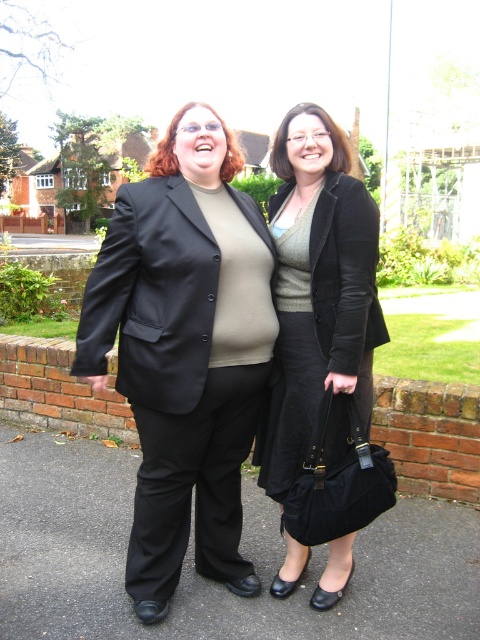
Question: Which of the following is the closest to the observer?

Choices:
 (A) (324, 525)
 (B) (173, 321)

Answer: (B)

Question: Does black smooth blazer at center have a lesser width compared to matte black skirt at center?

Choices:
 (A) yes
 (B) no

Answer: (B)

Question: Can you confirm if black smooth blazer at center is positioned below matte black skirt at center?

Choices:
 (A) yes
 (B) no

Answer: (A)

Question: Can you confirm if black smooth blazer at center is positioned to the right of matte black skirt at center?

Choices:
 (A) yes
 (B) no

Answer: (B)

Question: Which of the following is the farthest from the observer?

Choices:
 (A) black smooth blazer at center
 (B) matte black skirt at center

Answer: (B)